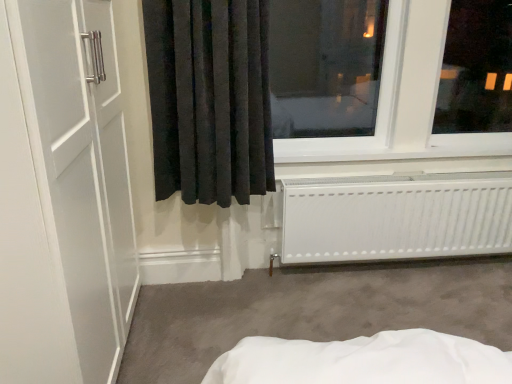
Measure the distance between transparent glass window at upper right and camera.

transparent glass window at upper right is 6.50 feet from camera.

The image size is (512, 384). Describe the element at coordinates (210, 99) in the screenshot. I see `black velvet curtain at center` at that location.

Locate an element on the screen. This screenshot has width=512, height=384. transparent glass window at upper right is located at coordinates (403, 100).

Which of these two, white matte radiator at lower right or black velvet curtain at center, is wider?

black velvet curtain at center.

Does white matte radiator at lower right turn towards black velvet curtain at center?

No, white matte radiator at lower right is not turned towards black velvet curtain at center.

Is white matte radiator at lower right behind black velvet curtain at center?

Yes, it is.

Does white plastic window sill at lower center appear on the left side of transparent glass window at upper right?

Indeed, white plastic window sill at lower center is positioned on the left side of transparent glass window at upper right.

Between white plastic window sill at lower center and transparent glass window at upper right, which one has larger size?

transparent glass window at upper right.

Does white plastic window sill at lower center touch transparent glass window at upper right?

white plastic window sill at lower center is not next to transparent glass window at upper right, and they're not touching.

Can you tell me how much white plastic window sill at lower center and transparent glass window at upper right differ in facing direction?

0.000288 degrees separate the facing orientations of white plastic window sill at lower center and transparent glass window at upper right.

This screenshot has height=384, width=512. I want to click on window sill above the white matte radiator at lower right (from the image's perspective), so click(391, 148).

From the image's perspective, which one is positioned higher, white plastic window sill at lower center or white matte radiator at lower right?

white plastic window sill at lower center, from the image's perspective.

Considering the positions of point (469, 155) and point (505, 229), is point (469, 155) closer or farther from the camera than point (505, 229)?

Point (469, 155) is positioned closer to the camera compared to point (505, 229).

What's the angular difference between white plastic window sill at lower center and white matte radiator at lower right's facing directions?

There is a 1.24-degree angle between the facing directions of white plastic window sill at lower center and white matte radiator at lower right.

Is transparent glass window at upper right wider than white plastic window sill at lower center?

Yes, transparent glass window at upper right is wider than white plastic window sill at lower center.

Between transparent glass window at upper right and white plastic window sill at lower center, which one has larger size?

transparent glass window at upper right.

Is transparent glass window at upper right beside white plastic window sill at lower center?

No, transparent glass window at upper right is not in contact with white plastic window sill at lower center.

Relative to white plastic window sill at lower center, is transparent glass window at upper right in front or behind?

transparent glass window at upper right is in front of white plastic window sill at lower center.

Considering the sizes of objects transparent glass window at upper right and black velvet curtain at center in the image provided, who is smaller, transparent glass window at upper right or black velvet curtain at center?

Smaller between the two is black velvet curtain at center.

Which object is further away from the camera taking this photo, transparent glass window at upper right or black velvet curtain at center?

transparent glass window at upper right is more distant.

From a real-world perspective, is transparent glass window at upper right above or below black velvet curtain at center?

From a real-world perspective, transparent glass window at upper right is physically above black velvet curtain at center.

Is point (448, 3) farther from camera compared to point (264, 37)?

Yes, point (448, 3) is behind point (264, 37).

From the image's perspective, which one is positioned lower, white matte radiator at lower right or white plastic window sill at lower center?

white matte radiator at lower right, from the image's perspective.

Is point (336, 261) positioned behind point (490, 152)?

No, it is not.

Considering the positions of objects white matte radiator at lower right and white plastic window sill at lower center in the image provided, who is behind, white matte radiator at lower right or white plastic window sill at lower center?

Positioned behind is white plastic window sill at lower center.

Considering the sizes of objects white matte radiator at lower right and white plastic window sill at lower center in the image provided, who is taller, white matte radiator at lower right or white plastic window sill at lower center?

With more height is white matte radiator at lower right.

Locate an element on the screen. The image size is (512, 384). curtain lying below the transparent glass window at upper right (from the image's perspective) is located at coordinates (210, 99).

Can you tell me how much black velvet curtain at center and transparent glass window at upper right differ in facing direction?

The angle between the facing direction of black velvet curtain at center and the facing direction of transparent glass window at upper right is 1.54 degrees.

Between black velvet curtain at center and transparent glass window at upper right, which one has smaller size?

black velvet curtain at center.

Is black velvet curtain at center far away from transparent glass window at upper right?

black velvet curtain at center is actually quite close to transparent glass window at upper right.

Where is `curtain on the left of white matte radiator at lower right`? The height and width of the screenshot is (384, 512). curtain on the left of white matte radiator at lower right is located at coordinates (210, 99).

At what (x,y) coordinates should I click in order to perform the action: click on window sill below the transparent glass window at upper right (from the image's perspective). Please return your answer as a coordinate pair (x, y). Looking at the image, I should click on (391, 148).

From the image, which object appears to be nearer to white plastic window sill at lower center, transparent glass window at upper right or black velvet curtain at center?

transparent glass window at upper right lies closer to white plastic window sill at lower center than the other object.

Estimate the real-world distances between objects in this image. Which object is further from transparent glass window at upper right, black velvet curtain at center or white matte radiator at lower right?

black velvet curtain at center lies further to transparent glass window at upper right than the other object.

Based on their spatial positions, is transparent glass window at upper right or black velvet curtain at center closer to white matte radiator at lower right?

transparent glass window at upper right is closer to white matte radiator at lower right.

Based on their spatial positions, is white plastic window sill at lower center or white matte radiator at lower right closer to black velvet curtain at center?

white plastic window sill at lower center lies closer to black velvet curtain at center than the other object.

From the image, which object appears to be nearer to white plastic window sill at lower center, white matte radiator at lower right or transparent glass window at upper right?

transparent glass window at upper right.

In the scene shown: Looking at the image, which one is located further to white plastic window sill at lower center, black velvet curtain at center or transparent glass window at upper right?

black velvet curtain at center is positioned further to the anchor white plastic window sill at lower center.

When comparing their distances from black velvet curtain at center, does white matte radiator at lower right or transparent glass window at upper right seem closer?

transparent glass window at upper right.

In the scene shown: When comparing their distances from transparent glass window at upper right, does white matte radiator at lower right or white plastic window sill at lower center seem closer?

Answer: white plastic window sill at lower center is positioned closer to the anchor transparent glass window at upper right.

Locate an element on the screen. window sill that lies between transparent glass window at upper right and white matte radiator at lower right from top to bottom is located at coordinates (391, 148).

This screenshot has height=384, width=512. I want to click on window sill between black velvet curtain at center and transparent glass window at upper right in the horizontal direction, so point(391,148).

This screenshot has height=384, width=512. What are the coordinates of `window between black velvet curtain at center and white matte radiator at lower right in the horizontal direction` in the screenshot? It's located at (403, 100).

Locate an element on the screen. window sill between black velvet curtain at center and white matte radiator at lower right is located at coordinates (391, 148).